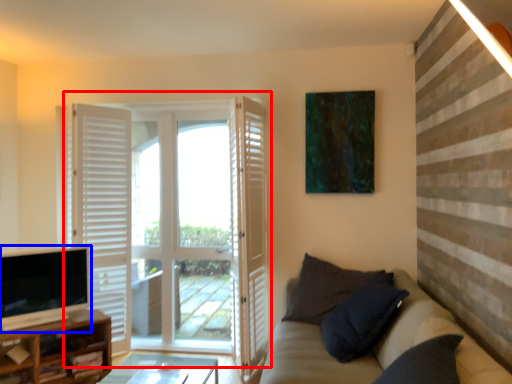
Question: Which object is further to the camera taking this photo, door (highlighted by a red box) or television (highlighted by a blue box)?

Choices:
 (A) door
 (B) television

Answer: (A)